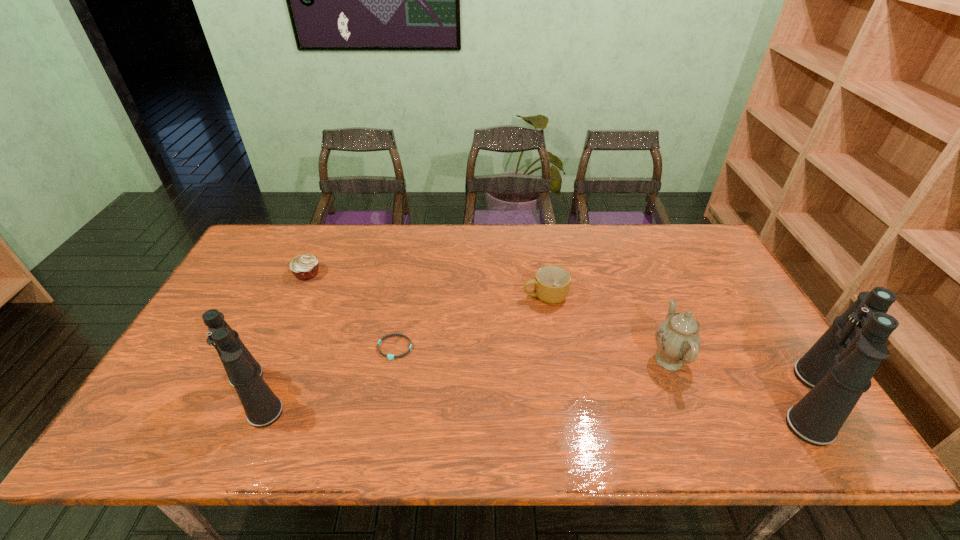
Locate an element on the screen. the left binoculars is located at coordinates (262, 407).

Find the location of a particular element. Image resolution: width=960 pixels, height=540 pixels. the fifth shortest object is located at coordinates (x=262, y=407).

This screenshot has height=540, width=960. Identify the location of the tallest object. (838, 368).

The height and width of the screenshot is (540, 960). Find the location of `the taller binoculars`. the taller binoculars is located at coordinates (838, 368).

The height and width of the screenshot is (540, 960). I want to click on muffin, so click(x=304, y=267).

Locate an element on the screen. The height and width of the screenshot is (540, 960). chinaware is located at coordinates point(678,340).

At what (x,y) coordinates should I click in order to perform the action: click on the third tallest object. Please return your answer as a coordinate pair (x, y). Looking at the image, I should click on (678, 340).

At what (x,y) coordinates should I click in order to perform the action: click on the third object from left to right. Please return your answer as a coordinate pair (x, y). Looking at the image, I should click on (390, 356).

Locate an element on the screen. the shortest object is located at coordinates (390, 356).

In order to click on mug in this screenshot , I will do `click(551, 284)`.